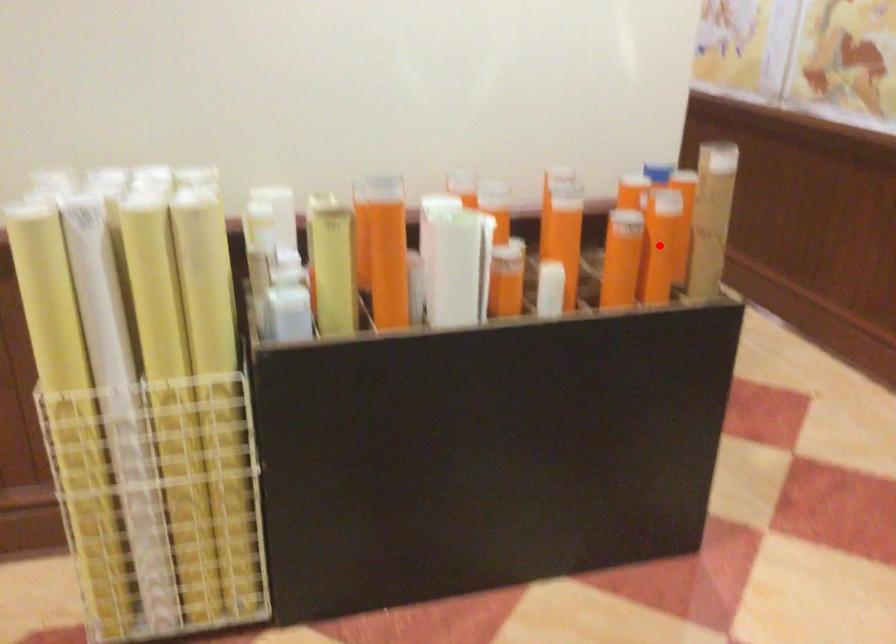
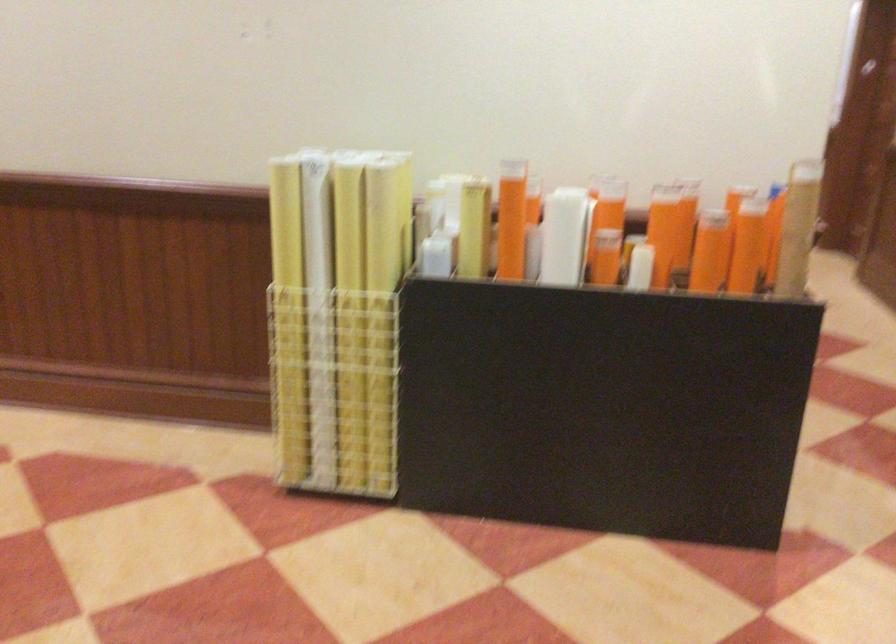
Question: I am providing you with two images of the same scene from different viewpoints. Image1 has a red point marked. In image2, the corresponding 3D location appears at what relative position? Reply with the corresponding letter.

Choices:
 (A) Closer
 (B) Farther

Answer: (B)